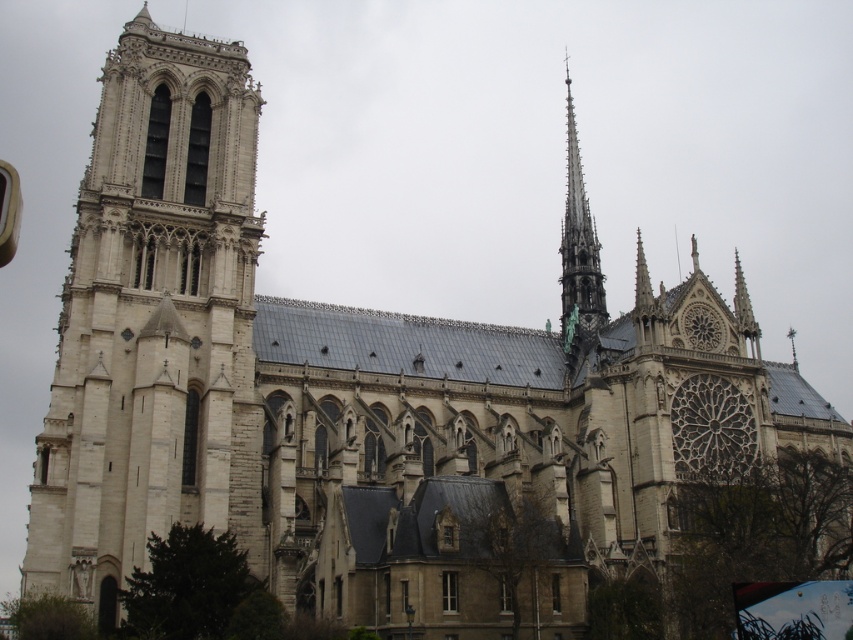
Question: Is white stone tower at left to the left of smooth gray spire at upper right from the viewer's perspective?

Choices:
 (A) yes
 (B) no

Answer: (A)

Question: Is white stone tower at left to the left of smooth gray spire at upper right from the viewer's perspective?

Choices:
 (A) no
 (B) yes

Answer: (B)

Question: Which point is closer to the camera?

Choices:
 (A) white stone tower at left
 (B) smooth gray spire at upper right

Answer: (A)

Question: Is white stone tower at left wider than smooth gray spire at upper right?

Choices:
 (A) yes
 (B) no

Answer: (A)

Question: Which point is closer to the camera taking this photo?

Choices:
 (A) (102, 387)
 (B) (575, 188)

Answer: (A)